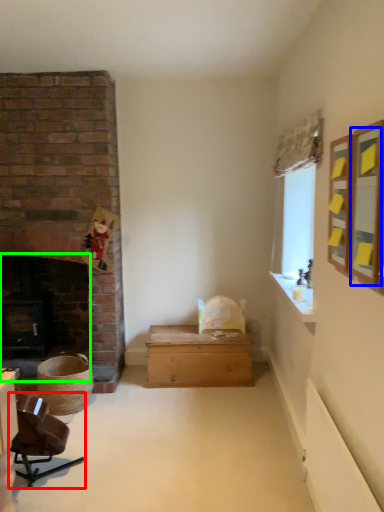
Question: Considering the real-world distances, which object is farthest from chair (highlighted by a red box)? mirror (highlighted by a blue box) or fireplace (highlighted by a green box)?

Choices:
 (A) mirror
 (B) fireplace

Answer: (A)